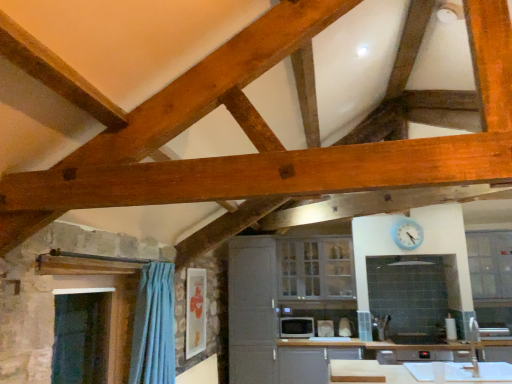
Question: Does white glossy microwave at center, which ranks as the first appliance in right-to-left order, lie behind blue plastic clock at upper center?

Choices:
 (A) no
 (B) yes

Answer: (B)

Question: Can you confirm if white glossy microwave at center, the 2th appliance from the left, is wider than blue plastic clock at upper center?

Choices:
 (A) yes
 (B) no

Answer: (B)

Question: Does white glossy microwave at center, the 2th appliance from the left, appear on the right side of blue plastic clock at upper center?

Choices:
 (A) no
 (B) yes

Answer: (A)

Question: From a real-world perspective, is white glossy microwave at center, which ranks as the first appliance in right-to-left order, located higher than blue plastic clock at upper center?

Choices:
 (A) no
 (B) yes

Answer: (A)

Question: Is white glossy microwave at center, the 2th appliance from the left, not near blue plastic clock at upper center?

Choices:
 (A) yes
 (B) no

Answer: (A)

Question: Considering the positions of point (66, 357) and point (263, 367), is point (66, 357) closer or farther from the camera than point (263, 367)?

Choices:
 (A) closer
 (B) farther

Answer: (A)

Question: In terms of size, does transparent plastic window screen at left appear bigger or smaller than white glossy cabinet at center, acting as the 2th cabinetry starting from the right?

Choices:
 (A) small
 (B) big

Answer: (A)

Question: Considering the positions of transparent plastic window screen at left and white glossy cabinet at center, the first cabinetry in the left-to-right sequence, in the image, is transparent plastic window screen at left taller or shorter than white glossy cabinet at center, the first cabinetry in the left-to-right sequence,?

Choices:
 (A) short
 (B) tall

Answer: (A)

Question: In terms of width, does transparent plastic window screen at left look wider or thinner when compared to white glossy cabinet at center, the first cabinetry in the left-to-right sequence?

Choices:
 (A) wide
 (B) thin

Answer: (B)

Question: Is blue plastic clock at upper center to the left or to the right of matte black microwave at center, the first appliance viewed from the left, in the image?

Choices:
 (A) left
 (B) right

Answer: (B)

Question: From the image's perspective, is blue plastic clock at upper center positioned above or below matte black microwave at center, the first appliance viewed from the left?

Choices:
 (A) below
 (B) above

Answer: (B)

Question: From a real-world perspective, is blue plastic clock at upper center positioned above or below matte black microwave at center, the first appliance viewed from the left?

Choices:
 (A) above
 (B) below

Answer: (A)

Question: Considering the positions of point [408, 240] and point [284, 322], is point [408, 240] closer or farther from the camera than point [284, 322]?

Choices:
 (A) farther
 (B) closer

Answer: (B)

Question: Is white glossy cabinet at center, the first cabinetry in the left-to-right sequence, taller or shorter than white glossy microwave at center, which ranks as the first appliance in right-to-left order?

Choices:
 (A) tall
 (B) short

Answer: (A)

Question: From the image's perspective, is white glossy cabinet at center, the first cabinetry in the left-to-right sequence, above or below white glossy microwave at center, which ranks as the first appliance in right-to-left order?

Choices:
 (A) above
 (B) below

Answer: (A)